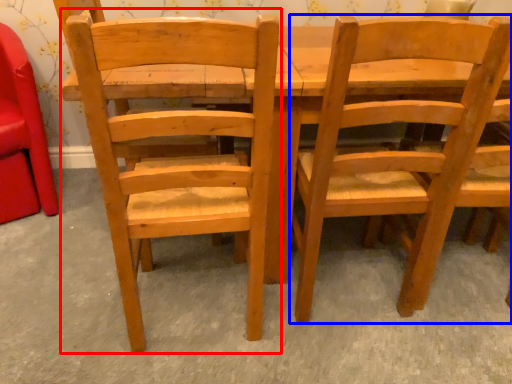
Question: Which object is closer to the camera taking this photo, chair (highlighted by a red box) or chair (highlighted by a blue box)?

Choices:
 (A) chair
 (B) chair

Answer: (A)